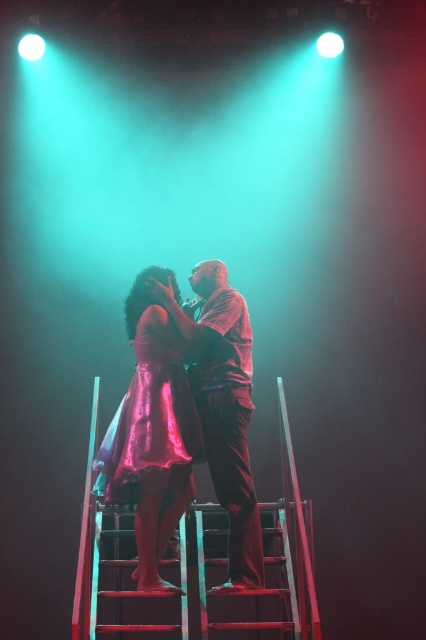
You are a photographer adjusting your camera to focus on two points on the stage. The first point is point [215,451], and the second is point [164,364]. Which point should you focus on first if you want to capture the closest object in the scene?

Point [215,451] is closer to the camera than point [164,364], so you should focus on point [215,451] first to capture the closest object in the scene.

You are a photographer trying to capture a closeup of the shiny pink dress at center without the matte brown shirt at center blocking it. Based on the scene, is this possible?

The shiny pink dress at center is behind the matte brown shirt at center, so it is blocked by the shirt and cannot be captured without moving either the dress or the shirt.

You are a photographer trying to capture a closeup of both the matte brown shirt at center and the shiny pink dress at center. Since the spotlight is limited, you can only focus on one object at a time. Which object should you focus on first if you want to ensure both are in focus without moving the camera?

The matte brown shirt at center is bigger than the shiny pink dress at center, so focusing on the larger matte brown shirt at center first will allow the camera to adjust the depth of field to include the smaller shiny pink dress at center in focus as well.